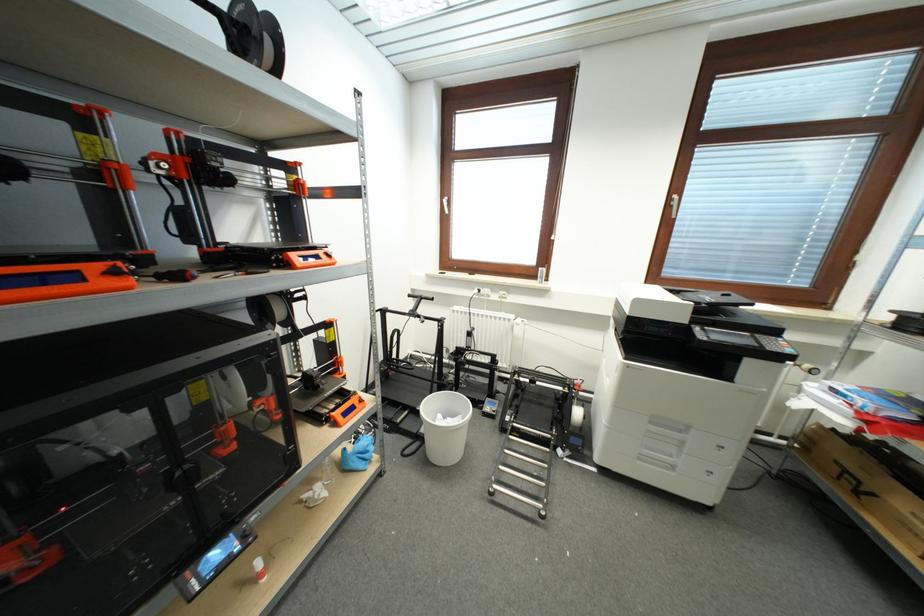
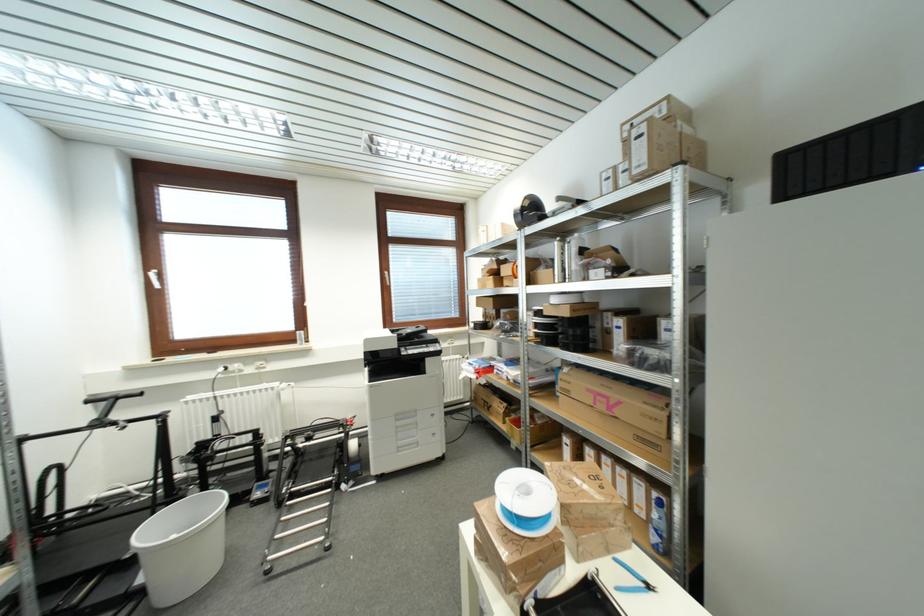
In the second image, find the point that corresponds to [658,431] in the first image.

(404, 426)